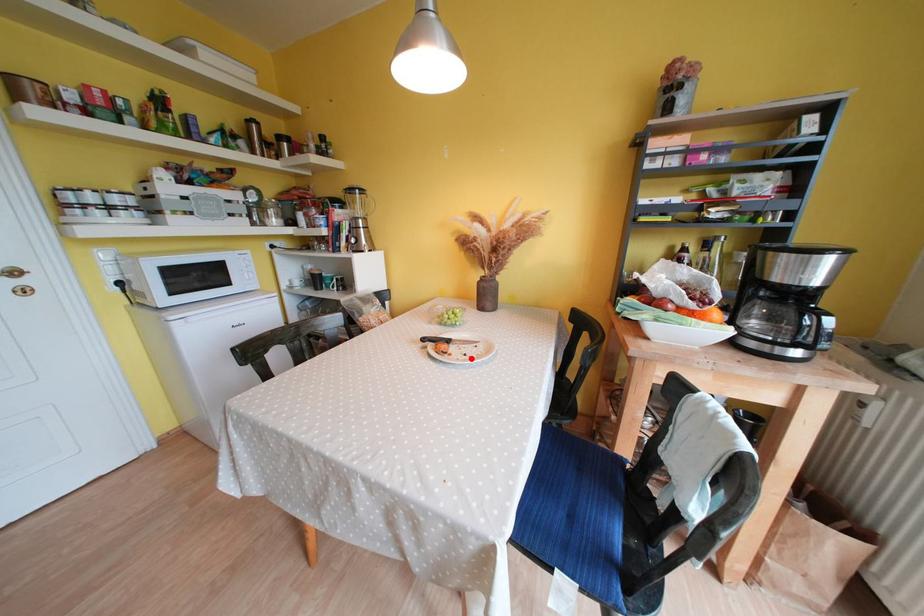
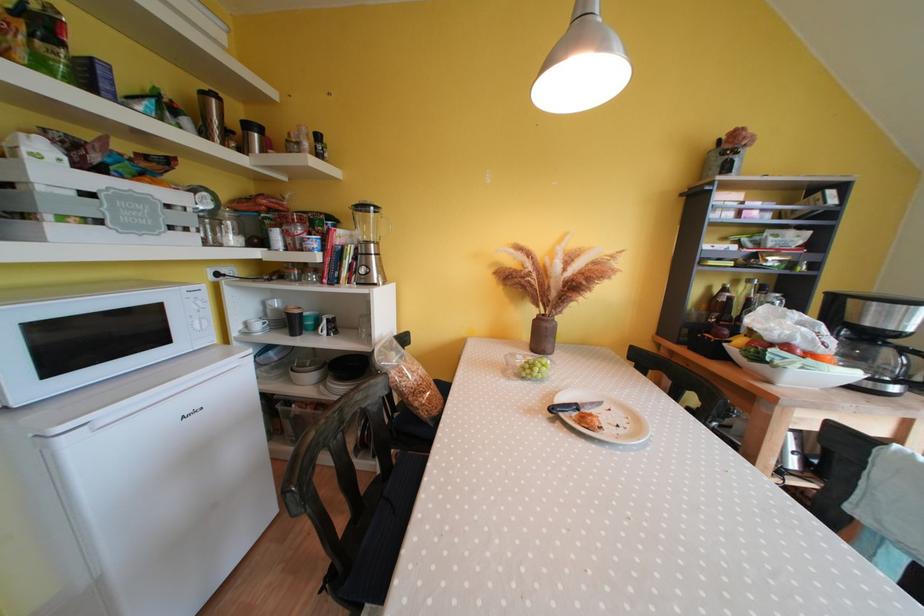
Find the pixel in the second image that matches the highlighted location in the first image.

(624, 430)